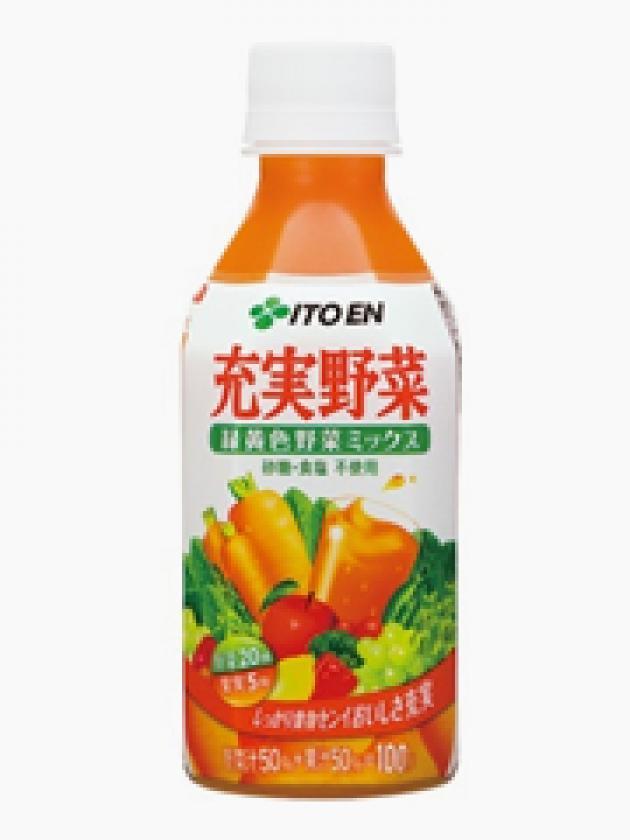
Identify the location of juice container. (301, 601).